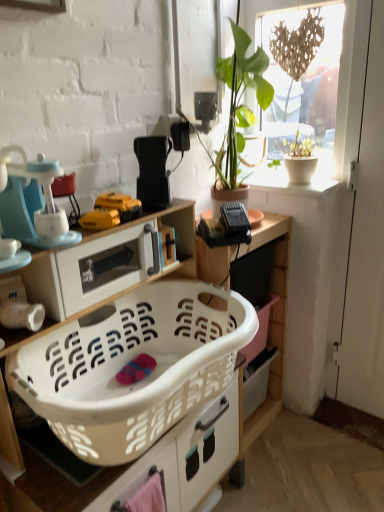
Question: Is point (94, 209) positioned closer to the camera than point (319, 49)?

Choices:
 (A) farther
 (B) closer

Answer: (B)

Question: Which is correct: yellow plastic drill at center, placed as the second toy when sorted from back to front, is inside transparent glass window at upper right, or outside of it?

Choices:
 (A) inside
 (B) outside

Answer: (B)

Question: Which object is positioned closest to the matte blue blender at left, acting as the 2th appliance starting from the bottom?

Choices:
 (A) green leafy plant at upper right
 (B) black plastic toaster at upper center, the third appliance in the bottom-to-top sequence
 (C) white plastic cabinet at center, which ranks as the second cabinetry in front-to-back order
 (D) white matte screen door at right
 (E) white plastic laundry basket at lower center, placed as the second cabinetry when sorted from back to front

Answer: (E)

Question: Which of these objects is positioned farthest from the yellow plastic drill at center, the 1th toy viewed from the front?

Choices:
 (A) black plastic toaster at upper center, the third appliance in the bottom-to-top sequence
 (B) white plastic laundry basket at lower center, placed as the 1th cabinetry when sorted from front to back
 (C) white glossy microwave at upper left, which is the first appliance from bottom to top
 (D) matte blue blender at left, marked as the 2th appliance in a top-to-bottom arrangement
 (E) white matte screen door at right

Answer: (E)